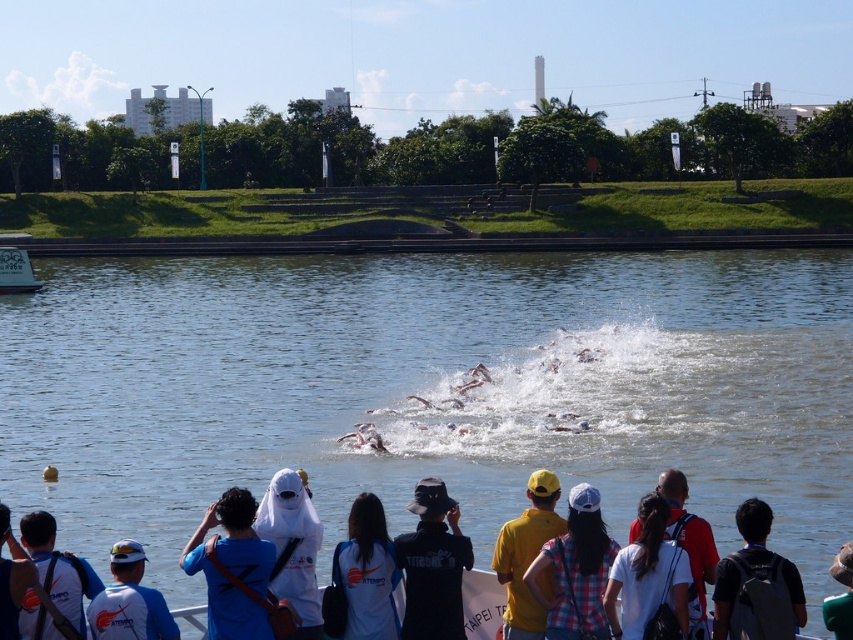
You are a photographer at the swimming event. You want to capture a photo that includes both the white matte shirt at lower right and the white matte shirt at lower left. Which shirt should you focus on first to ensure both are in the frame?

The white matte shirt at lower right is positioned over the white matte shirt at lower left, so you should focus on the white matte shirt at lower right first to ensure both are in the frame.